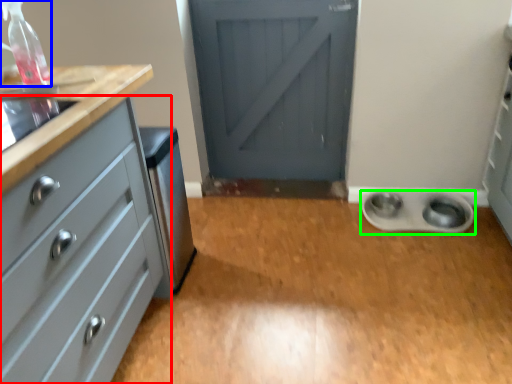
Question: Considering the real-world distances, which object is farthest from chest of drawers (highlighted by a red box)? bottle (highlighted by a blue box) or appliance (highlighted by a green box)?

Choices:
 (A) bottle
 (B) appliance

Answer: (B)